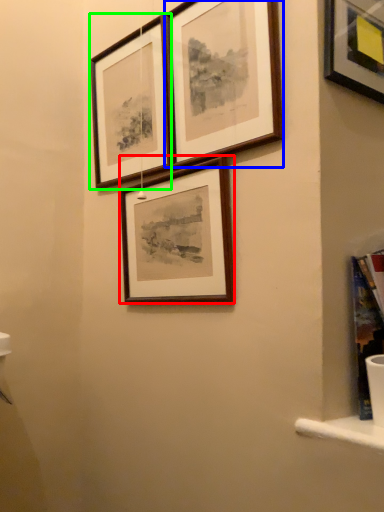
Question: Based on their relative distances, which object is farther from picture frame (highlighted by a red box)? Choose from picture frame (highlighted by a blue box) and picture frame (highlighted by a green box).

Choices:
 (A) picture frame
 (B) picture frame

Answer: (B)